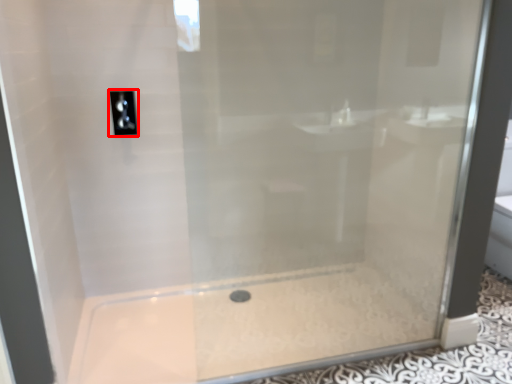
Question: Observing the image, what is the correct spatial positioning of light switch (annotated by the red box) in reference to bath?

Choices:
 (A) left
 (B) right

Answer: (A)